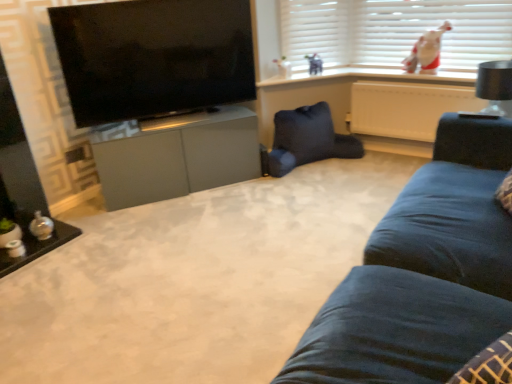
Question: Would you say white plastic radiator at upper right is to the left or to the right of black glossy tv at upper left in the picture?

Choices:
 (A) right
 (B) left

Answer: (A)

Question: From the image's perspective, relative to black glossy tv at upper left, is white plastic radiator at upper right above or below?

Choices:
 (A) below
 (B) above

Answer: (A)

Question: Which object is the farthest from the black matte lampshade at upper right?

Choices:
 (A) white plastic radiator at upper right
 (B) white plush toy at upper right
 (C) dark blue fabric swivel chair at center
 (D) white matte shutter at upper center
 (E) white plush toy at upper center

Answer: (E)

Question: Estimate the real-world distances between objects in this image. Which object is farther from the black matte lampshade at upper right?

Choices:
 (A) matte gray cabinet at center
 (B) white plush toy at upper right
 (C) white matte shutter at upper center
 (D) black glossy tv at upper left
 (E) white plastic radiator at upper right

Answer: (D)